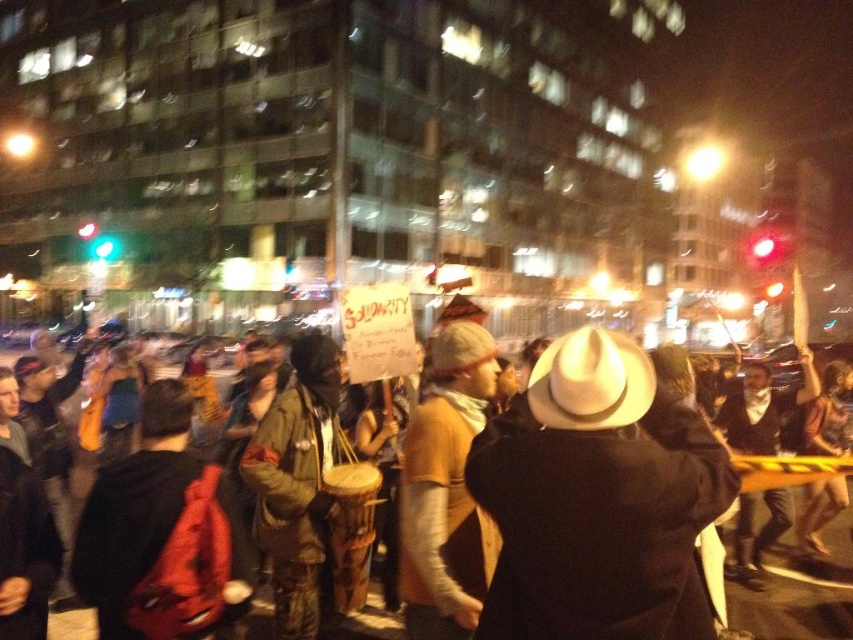
Who is taller, white matte hat at center or brown leather jacket at center?

white matte hat at center is taller.

Is white matte hat at center to the right of brown leather jacket at center from the viewer's perspective?

In fact, white matte hat at center is to the left of brown leather jacket at center.

Does point (650, 560) lie in front of point (62, 621)?

Yes, point (650, 560) is closer to viewer.

Identify the location of white matte hat at center. The width and height of the screenshot is (853, 640). (598, 500).